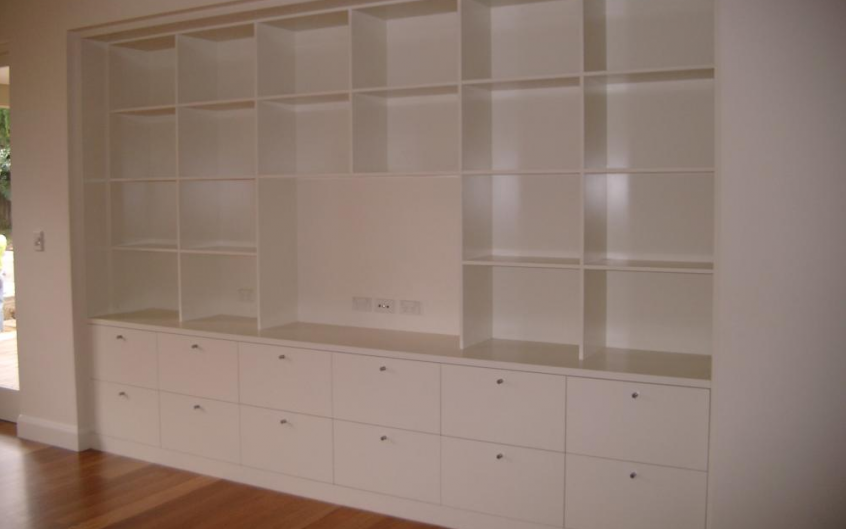
This screenshot has height=529, width=846. I want to click on wall outlet, so click(243, 297), click(360, 309), click(386, 308), click(418, 310).